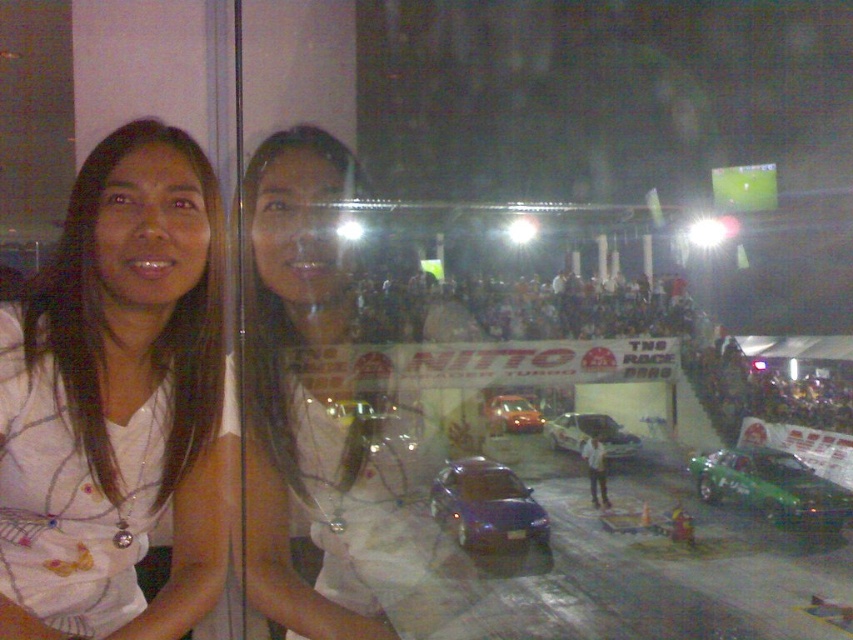
You are a photographer trying to capture the reflection of both the white fabric shirt at left and the green glossy car at lower right in the mirrored surface. Based on their sizes in the reflection, which object would appear smaller?

The white fabric shirt at left appears smaller in the reflection because it occupies less space than the green glossy car at lower right.

You are standing in front of a mirrored glass window that reflects the two cars outside. The scene shows a matte blue car at center and a shiny silver car at center. Which car is positioned lower in the real world outside the glass?

The matte blue car at center is located below the shiny silver car at center in the real world, so its reflection would appear higher on the mirrored glass. Therefore, the shiny silver car at center is positioned lower in the real world outside the glass.

You are standing in front of a reflective glass surface. You see a point marked at coordinates [138,342]. What object is located at that point?

The white fabric shirt at left is located at point [138,342].